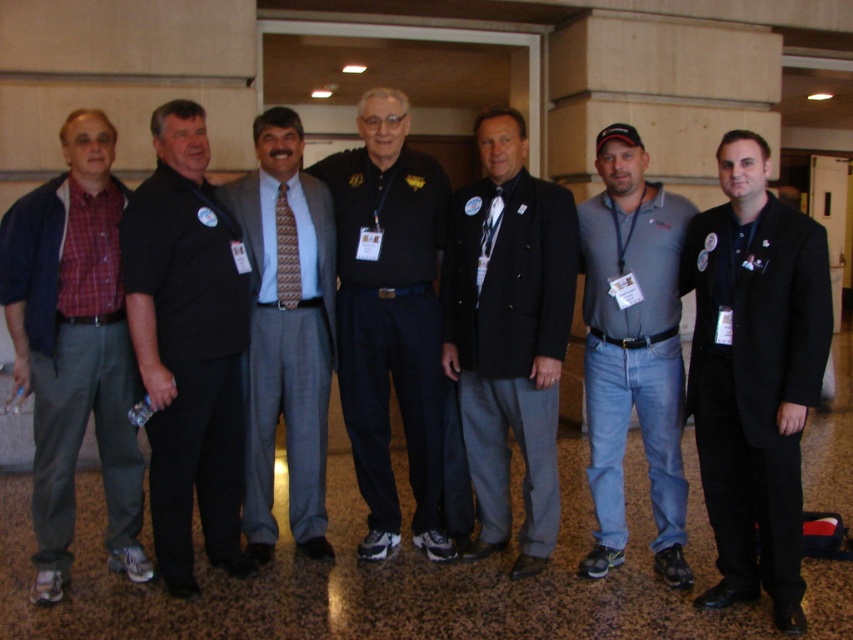
Question: Considering the real-world distances, which object is farthest from the black cotton polo shirt at center?

Choices:
 (A) patterned silk tie at center
 (B) black wool coat at center
 (C) black shirt at center

Answer: (B)

Question: Can you confirm if denim jeans at center is positioned to the right of patterned silk tie at center?

Choices:
 (A) no
 (B) yes

Answer: (B)

Question: Which object appears farthest from the camera in this image?

Choices:
 (A) black wool coat at center
 (B) orange patterned tie at center
 (C) light blue textured pants at center

Answer: (B)

Question: Is matte black jacket at center to the left of light blue textured pants at center from the viewer's perspective?

Choices:
 (A) yes
 (B) no

Answer: (B)

Question: Which point is farther to the camera?

Choices:
 (A) (274, 264)
 (B) (445, 284)
 (C) (79, 257)

Answer: (B)

Question: Can you confirm if plaid cotton shirt at left is positioned to the right of denim jeans at center?

Choices:
 (A) yes
 (B) no

Answer: (B)